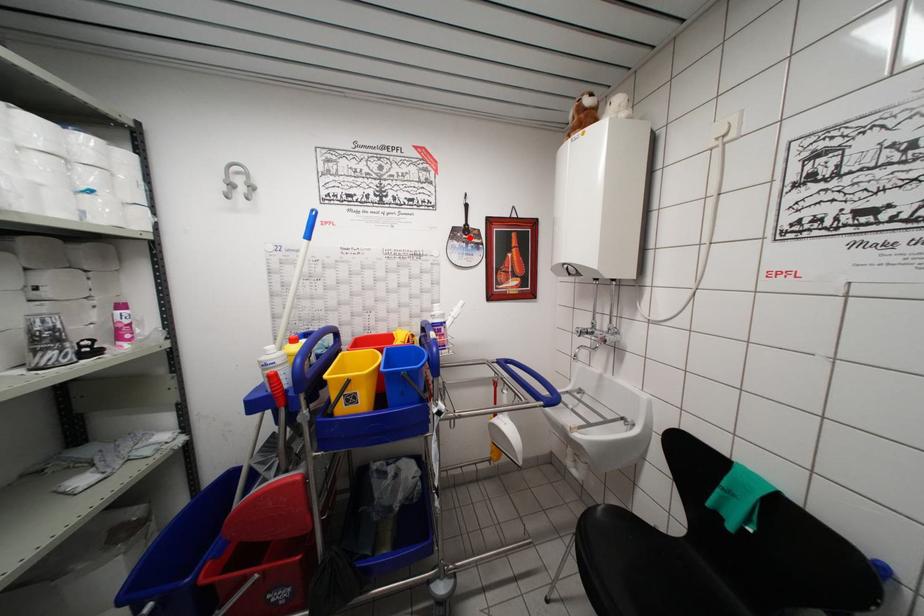
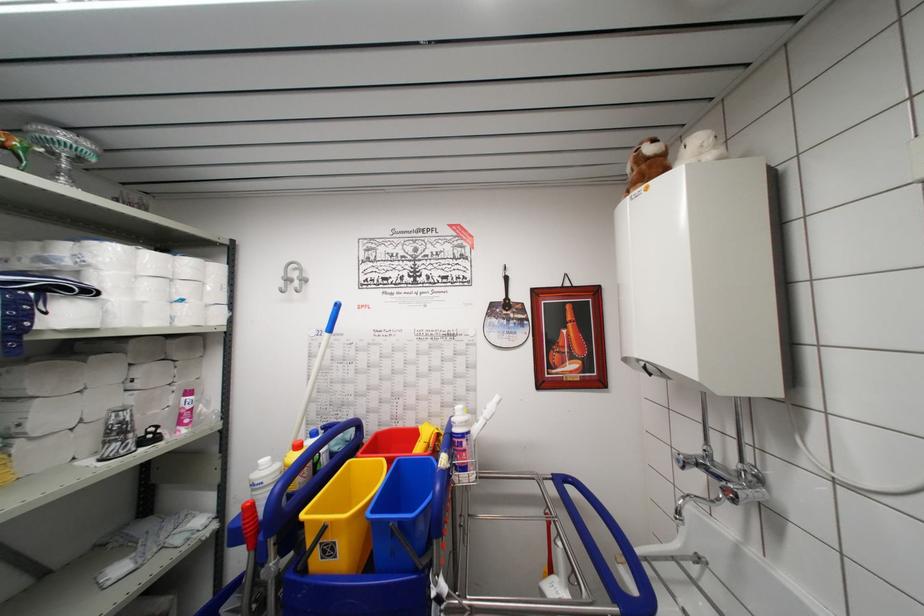
Question: I am providing you with two images of the same scene from different viewpoints. A red point is marked on the first image. At the location where the point appears in image 1, is it still visible in image 2?

Choices:
 (A) Yes
 (B) No

Answer: (A)